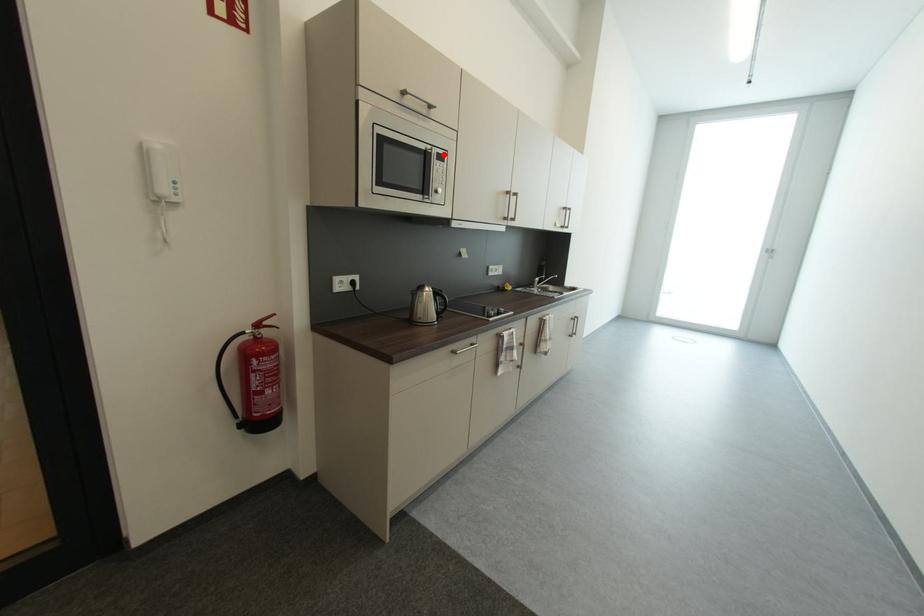
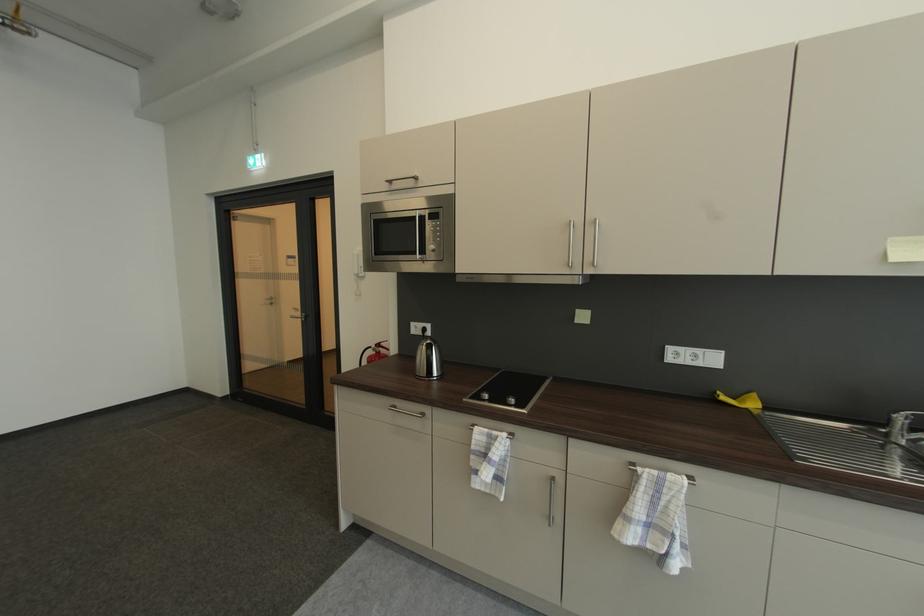
Find the pixel in the second image that matches the highlighted location in the first image.

(436, 215)